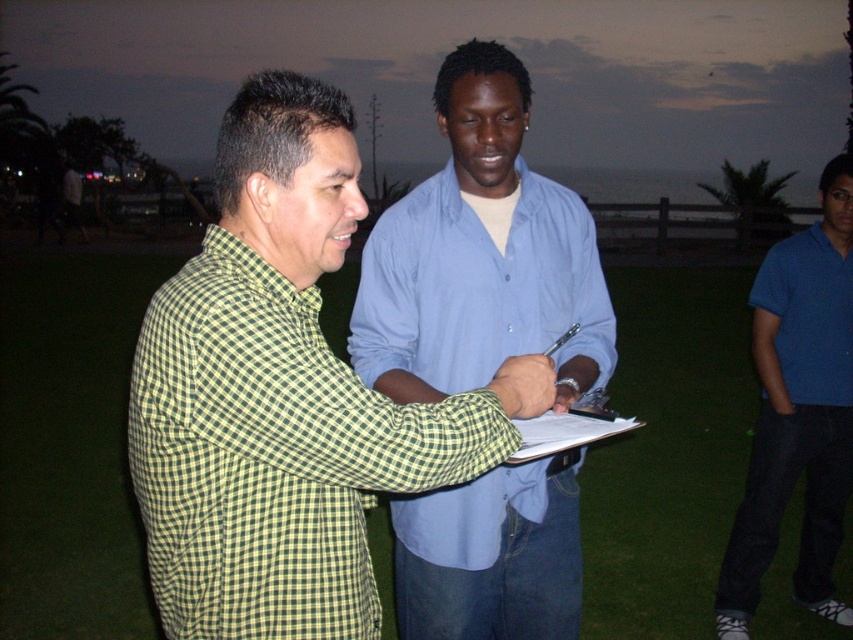
Is green checkered shirt at center smaller than blue cotton polo shirt at right?

No.

At what (x,y) coordinates should I click in order to perform the action: click on green checkered shirt at center. Please return your answer as a coordinate pair (x, y). The height and width of the screenshot is (640, 853). Looking at the image, I should click on (283, 396).

Does blue cotton polo shirt at right appear over white paper at center?

Yes.

At what (x,y) coordinates should I click in order to perform the action: click on blue cotton polo shirt at right. Please return your answer as a coordinate pair (x, y). Looking at the image, I should click on (809, 316).

Which is more to the left, blue cotton shirt at right or white paper at center?

white paper at center

Is point (828, 452) positioned in front of point (566, 438)?

No, it is behind (566, 438).

Identify the location of blue cotton shirt at right. This screenshot has width=853, height=640. (798, 412).